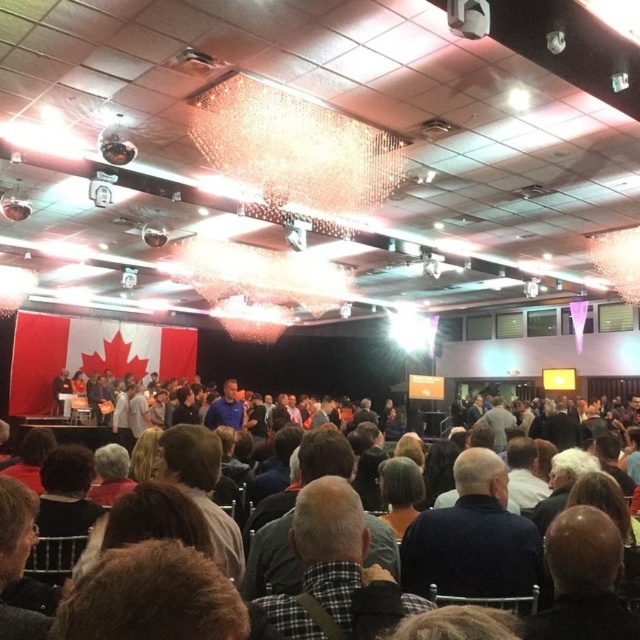
Does dark gray fabric crowd at center lie in front of dark blue sweater at center?

Yes, dark gray fabric crowd at center is closer to the viewer.

How far apart are dark gray fabric crowd at center and dark blue sweater at center?

dark gray fabric crowd at center is 1.86 inches from dark blue sweater at center.

Which is in front, point (481, 497) or point (502, 481)?

Positioned in front is point (481, 497).

At what (x,y) coordinates should I click in order to perform the action: click on dark gray fabric crowd at center. Please return your answer as a coordinate pair (x, y). Looking at the image, I should click on (504, 536).

Is dark gray fabric crowd at center positioned before bald head at center?

No.

Can you confirm if dark gray fabric crowd at center is wider than bald head at center?

Yes, dark gray fabric crowd at center is wider than bald head at center.

Locate an element on the screen. dark gray fabric crowd at center is located at coordinates (504, 536).

Locate an element on the screen. The height and width of the screenshot is (640, 640). dark gray fabric crowd at center is located at coordinates (504, 536).

Is dark blue sweater at center to the right of bald head at center from the viewer's perspective?

Incorrect, dark blue sweater at center is not on the right side of bald head at center.

Who is more forward, (444, 528) or (545, 621)?

Point (545, 621) is in front.

Is point (492, 524) positioned behind point (557, 554)?

Yes, point (492, 524) is behind point (557, 554).

In order to click on dark blue sweater at center in this screenshot , I will do `click(472, 538)`.